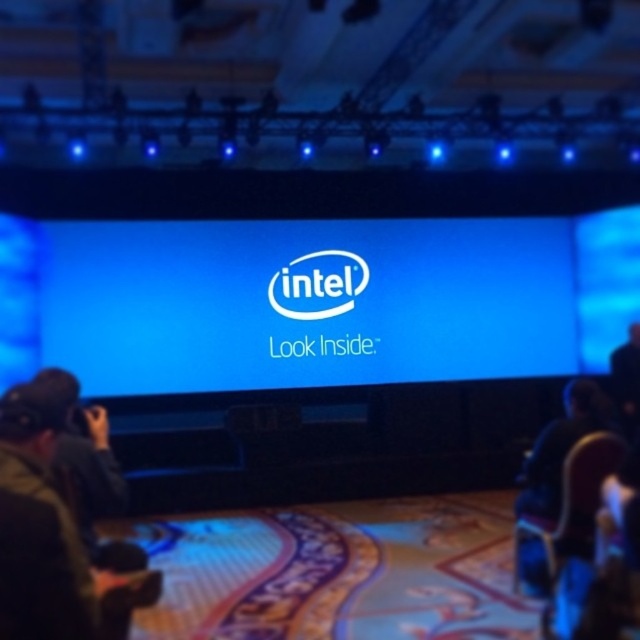
This screenshot has width=640, height=640. What do you see at coordinates (51, 536) in the screenshot?
I see `dark green jacket at lower left` at bounding box center [51, 536].

Based on the photo, can you confirm if dark green jacket at lower left is positioned above white smooth logo at center?

Incorrect, dark green jacket at lower left is not positioned above white smooth logo at center.

Between point (44, 522) and point (340, 300), which one is positioned behind?

Point (340, 300)

Image resolution: width=640 pixels, height=640 pixels. What are the coordinates of `dark green jacket at lower left` in the screenshot? It's located at (51, 536).

Can you confirm if blue glossy screen at center is positioned to the right of white smooth logo at center?

In fact, blue glossy screen at center is to the left of white smooth logo at center.

Locate an element on the screen. The height and width of the screenshot is (640, 640). blue glossy screen at center is located at coordinates (285, 301).

At what (x,y) coordinates should I click in order to perform the action: click on blue glossy screen at center. Please return your answer as a coordinate pair (x, y). Looking at the image, I should click on (285, 301).

Who is lower down, dark green jacket at lower left or black fabric man at right?

black fabric man at right

The image size is (640, 640). In order to click on dark green jacket at lower left in this screenshot , I will do `click(51, 536)`.

Which is behind, point (36, 493) or point (628, 385)?

Positioned behind is point (628, 385).

Where is `dark green jacket at lower left`? dark green jacket at lower left is located at coordinates (51, 536).